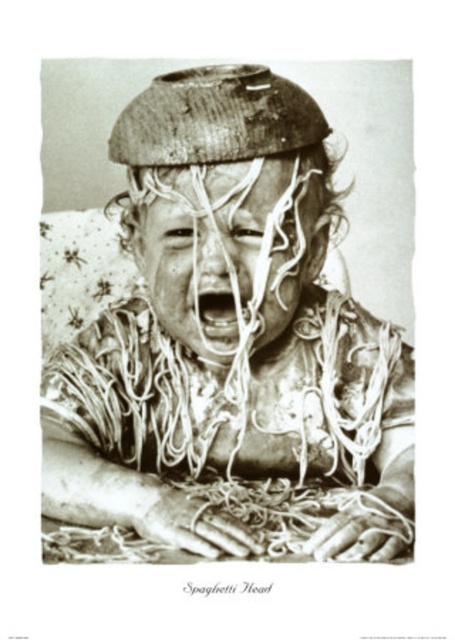
Does wooden bowl at upper center come behind smooth white noodles at center?

No, it is in front of smooth white noodles at center.

Who is taller, wooden bowl at upper center or smooth white noodles at center?

With more height is wooden bowl at upper center.

Does point (217, 337) come closer to viewer compared to point (157, 294)?

Yes, it is.

The width and height of the screenshot is (455, 640). What are the coordinates of `wooden bowl at upper center` in the screenshot? It's located at (231, 346).